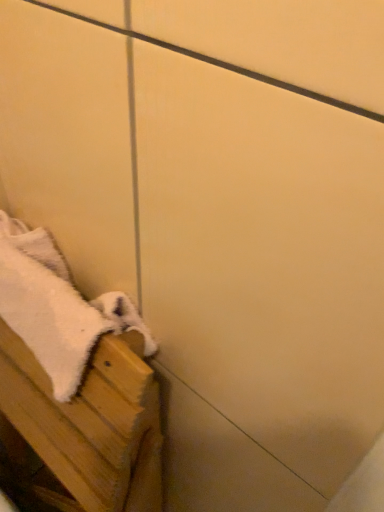
Question: Based on their sizes in the image, would you say white fluffy towel at lower left is bigger or smaller than white fluffy towel at lower left?

Choices:
 (A) small
 (B) big

Answer: (B)

Question: Considering the relative positions of white fluffy towel at lower left and white fluffy towel at lower left in the image provided, is white fluffy towel at lower left to the left or to the right of white fluffy towel at lower left?

Choices:
 (A) left
 (B) right

Answer: (A)

Question: From a real-world perspective, relative to white fluffy towel at lower left, is white fluffy towel at lower left vertically above or below?

Choices:
 (A) below
 (B) above

Answer: (A)

Question: Is white fluffy towel at lower left in front of or behind white fluffy towel at lower left in the image?

Choices:
 (A) front
 (B) behind

Answer: (B)

Question: Is white fluffy towel at lower left taller or shorter than white fluffy towel at lower left?

Choices:
 (A) short
 (B) tall

Answer: (A)

Question: Is white fluffy towel at lower left wider or thinner than white fluffy towel at lower left?

Choices:
 (A) thin
 (B) wide

Answer: (A)

Question: Considering the relative positions of white fluffy towel at lower left and white fluffy towel at lower left in the image provided, is white fluffy towel at lower left to the left or to the right of white fluffy towel at lower left?

Choices:
 (A) right
 (B) left

Answer: (A)